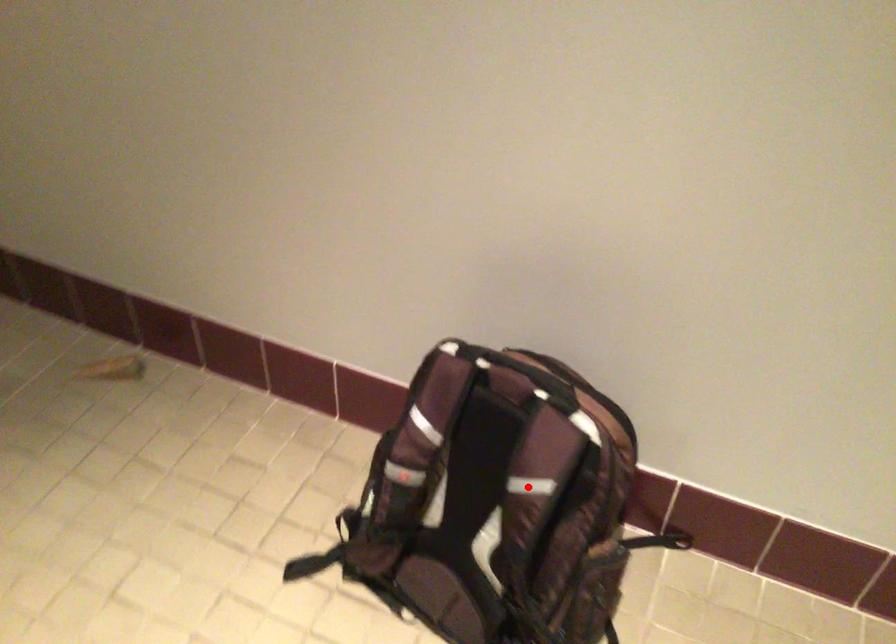
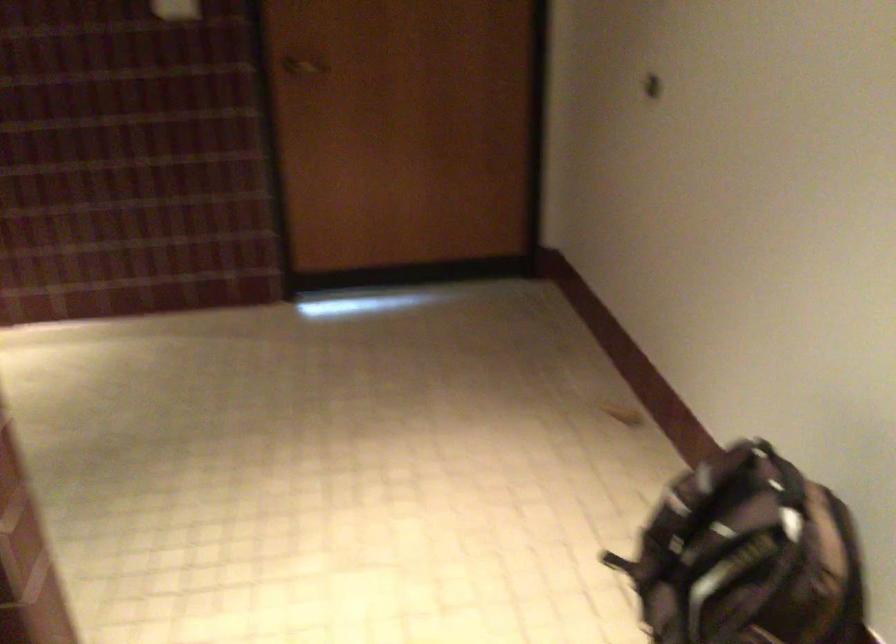
In the second image, find the point that corresponds to the highlighted location in the first image.

(748, 556)